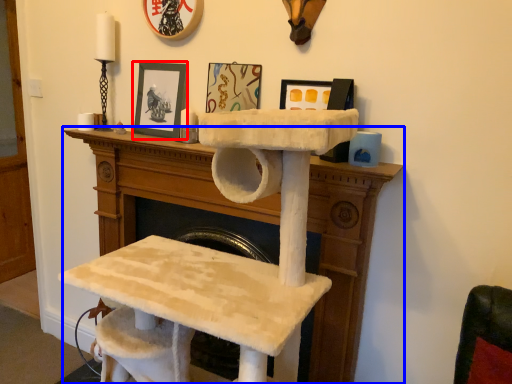
Question: Which of the following is the farthest to the observer, picture frame (highlighted by a red box) or furniture (highlighted by a blue box)?

Choices:
 (A) picture frame
 (B) furniture

Answer: (A)